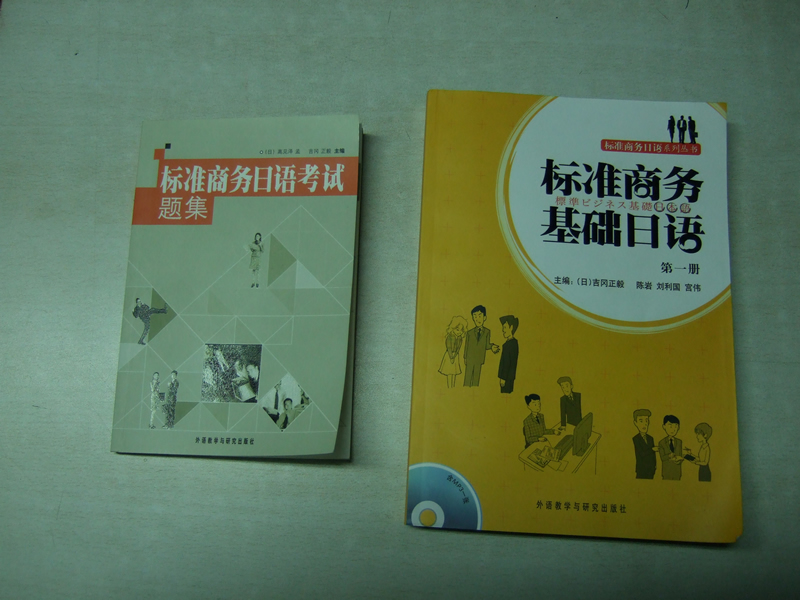
Where is `larger book`? Image resolution: width=800 pixels, height=600 pixels. larger book is located at coordinates (481, 276).